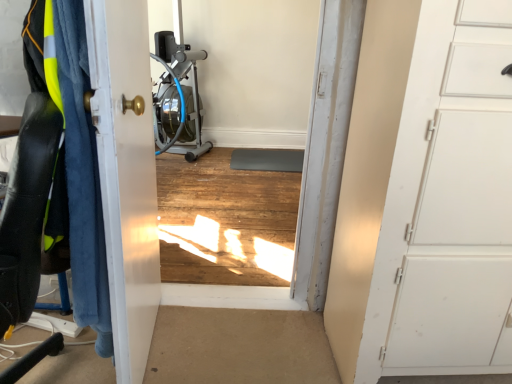
Where is `vacant space in white glossy door at left, arranged as the second door when viewed from the right (from a real-world perspective)`? vacant space in white glossy door at left, arranged as the second door when viewed from the right (from a real-world perspective) is located at coordinates (156, 339).